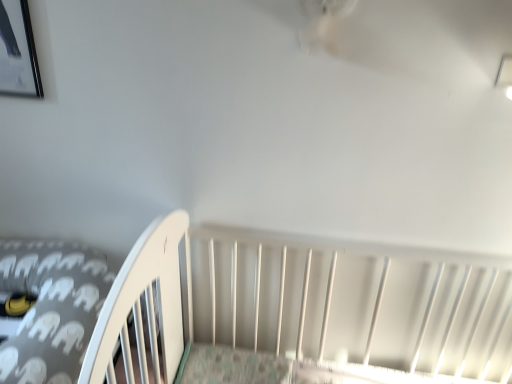
You are a GUI agent. You are given a task and a screenshot of the screen. Output one action in this format:
    pyautogui.click(x=<x>, y=<y>)
    Task: Click on the gray elephant-patterned fabric at lower left
    
    Given the screenshot: What is the action you would take?
    pyautogui.click(x=52, y=308)

What do you see at coordinates (52, 308) in the screenshot? I see `gray elephant-patterned fabric at lower left` at bounding box center [52, 308].

Measure the distance between gray elephant-patterned fabric at lower left and camera.

gray elephant-patterned fabric at lower left and camera are 38.93 inches apart.

The width and height of the screenshot is (512, 384). I want to click on gray elephant-patterned fabric at lower left, so point(52,308).